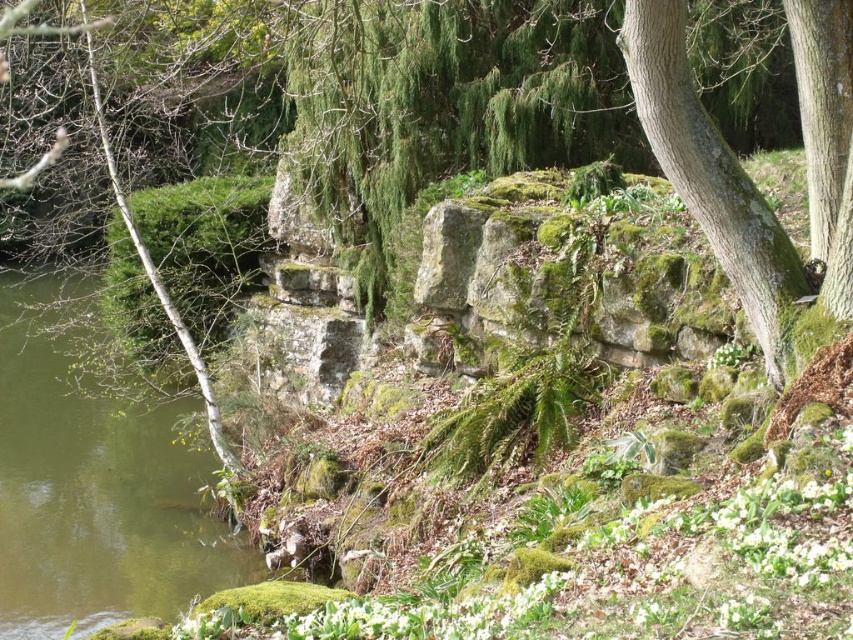
Based on the photo, can you confirm if green liquid water at left is positioned to the left of green rough bark tree at right?

Correct, you'll find green liquid water at left to the left of green rough bark tree at right.

Is green liquid water at left positioned at the back of green rough bark tree at right?

Yes.

Between point (12, 609) and point (693, 136), which one is positioned behind?

The point (12, 609) is more distant.

I want to click on green liquid water at left, so click(94, 492).